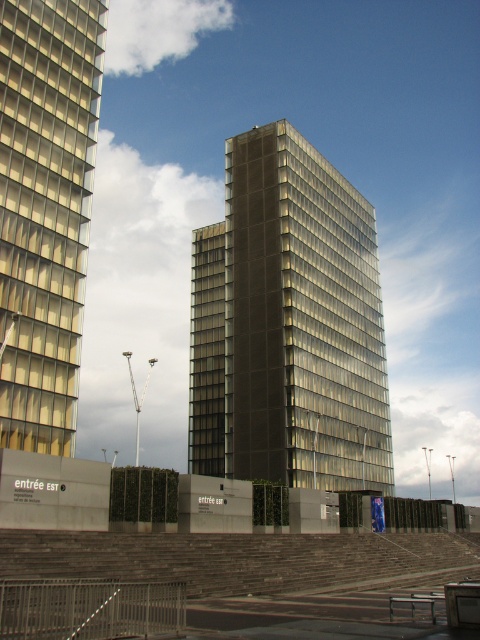
You are standing at the base of the matte glass tower at center, and you want to take a photo of it from a distance that allows you to capture the entire structure without cropping. Considering the camera you have can focus clearly up to 250 feet, will you be able to take a clear photo from your current position?

The matte glass tower at center is 246.62 feet away from the camera. Since the camera can focus clearly up to 250 feet, you can take a clear photo from your current position as the distance is within the camera range.

You are a drone operator who needs to fly a drone between the matte glass tower at center and the matte glass building at left. Given that the minimum safe distance for drone flight between two structures is 150 feet, can you safely fly the drone through the gap between them?

The matte glass tower at center is 140.83 feet away from the matte glass building at left. Since the distance between them is less than the required 150 feet minimum safe distance, it is not safe to fly the drone through the gap between them.

Consider the image. You are a drone operator trying to fly a drone between the two buildings. The drone has a maximum flight height of 100 meters. Given the scene, can you safely fly the drone between the matte glass tower at center and the matte glass building at left without hitting either structure?

The matte glass tower at center is much taller than the matte glass building at left, so the drone can safely fly between them as long as it stays below the height of the shorter matte glass building at left, which is within the drone operator